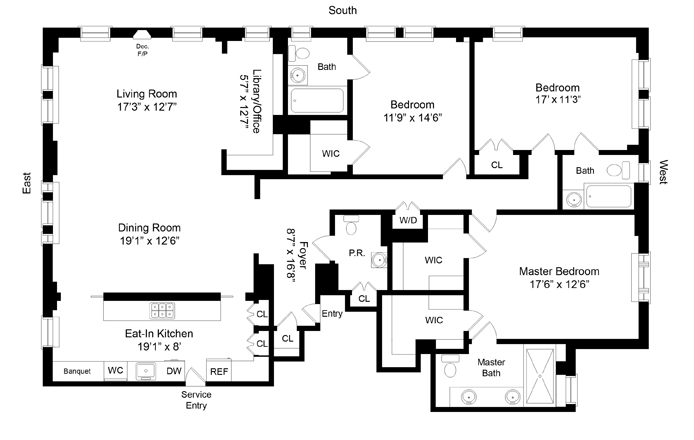
Locate an element on the screen. bath is located at coordinates (323, 80).